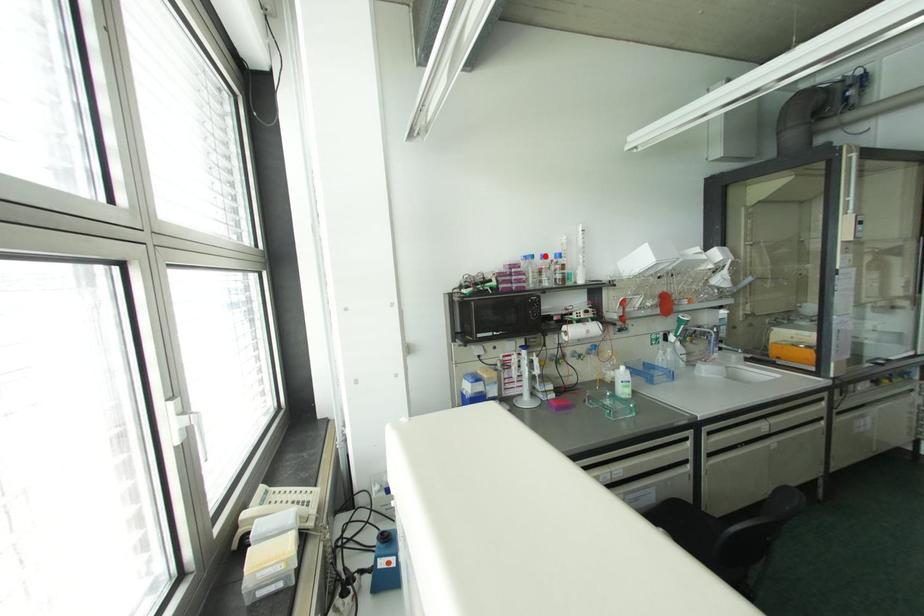
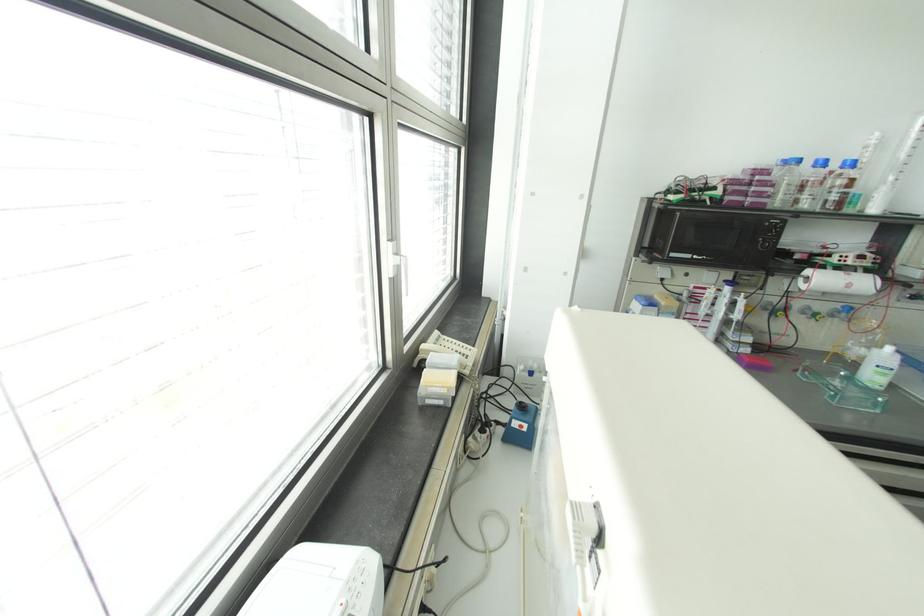
In the second image, find the point that corresponds to the highlighted location in the first image.

(822, 163)